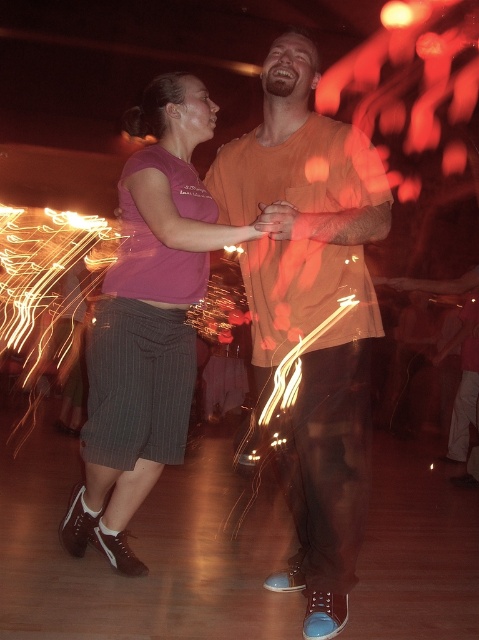
Does orange cotton shirt at center appear on the left side of purple cotton shirt at center?

Incorrect, orange cotton shirt at center is not on the left side of purple cotton shirt at center.

Does point (319, 634) lie in front of point (148, 419)?

Yes, it is.

Between point (327, 465) and point (111, 516), which one is positioned behind?

Point (111, 516)

Locate an element on the screen. The height and width of the screenshot is (640, 479). orange cotton shirt at center is located at coordinates (310, 308).